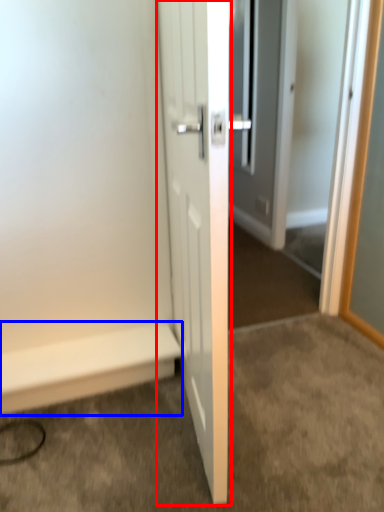
Question: Which object is closer to the camera taking this photo, door (highlighted by a red box) or stairwell (highlighted by a blue box)?

Choices:
 (A) door
 (B) stairwell

Answer: (A)